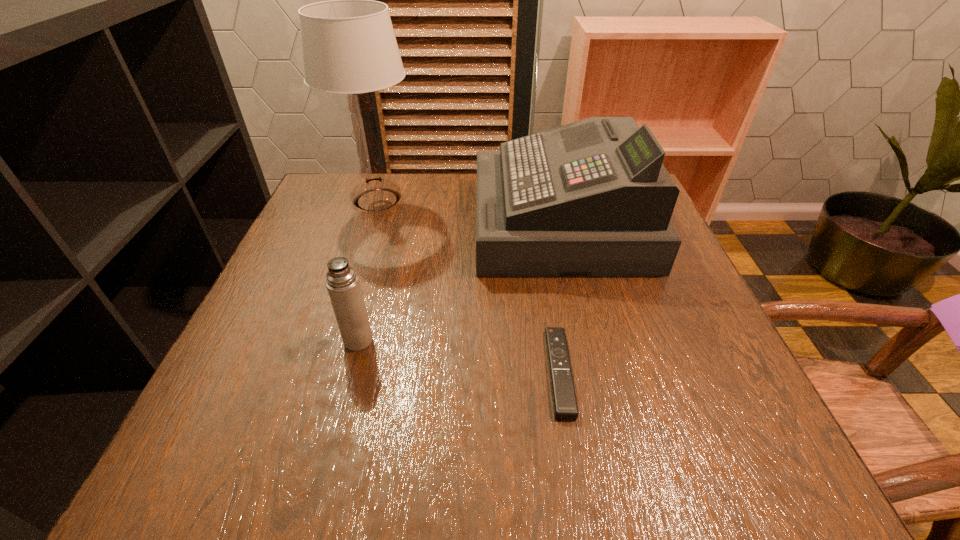
At what (x,y) coordinates should I click in order to perform the action: click on table lamp present at the far edge. Please return your answer as a coordinate pair (x, y). The width and height of the screenshot is (960, 540). Looking at the image, I should click on (349, 46).

At what (x,y) coordinates should I click in order to perform the action: click on cash register located in the far edge section of the desktop. Please return your answer as a coordinate pair (x, y). The image size is (960, 540). Looking at the image, I should click on (590, 198).

Where is `object present at the near edge`? Image resolution: width=960 pixels, height=540 pixels. object present at the near edge is located at coordinates (565, 406).

Locate an element on the screen. Image resolution: width=960 pixels, height=540 pixels. object that is at the left edge is located at coordinates (349, 46).

Locate an element on the screen. The height and width of the screenshot is (540, 960). object that is at the right edge is located at coordinates (590, 198).

Where is `object that is at the far left corner`? object that is at the far left corner is located at coordinates (349, 46).

Where is `object positioned at the far right corner`? object positioned at the far right corner is located at coordinates (590, 198).

Where is `blank space at the far edge of the desktop`? The image size is (960, 540). blank space at the far edge of the desktop is located at coordinates (467, 194).

Locate an element on the screen. This screenshot has width=960, height=540. free point at the near edge is located at coordinates (464, 470).

Locate an element on the screen. The image size is (960, 540). vacant space at the left edge of the desktop is located at coordinates (343, 244).